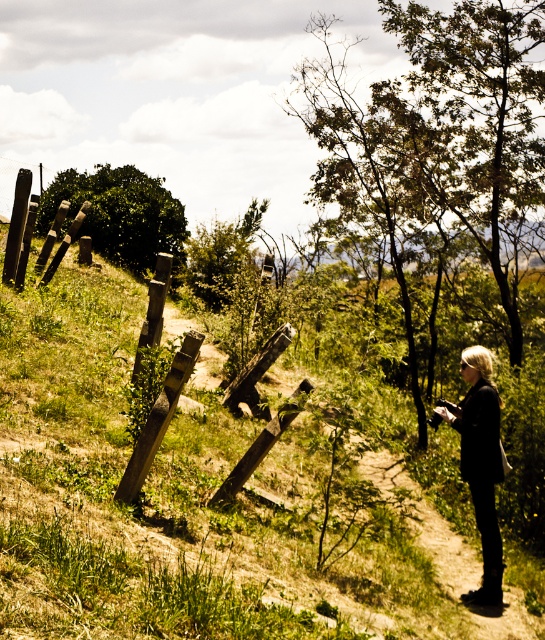
Question: Among these objects, which one is nearest to the camera?

Choices:
 (A) green leafy tree at upper left
 (B) black leather jacket at lower right
 (C) green leafy tree at right

Answer: (B)

Question: Which of the following is the closest to the observer?

Choices:
 (A) black leather jacket at lower right
 (B) green leafy tree at upper left

Answer: (A)

Question: Does green leafy tree at right appear on the right side of green leafy tree at upper left?

Choices:
 (A) no
 (B) yes

Answer: (B)

Question: Which object is farther from the camera taking this photo?

Choices:
 (A) black leather jacket at lower right
 (B) green leafy tree at upper left
 (C) green leafy tree at right

Answer: (B)

Question: Is green leafy tree at upper left above black leather jacket at lower right?

Choices:
 (A) no
 (B) yes

Answer: (B)

Question: Does green leafy tree at right lie in front of black leather jacket at lower right?

Choices:
 (A) no
 (B) yes

Answer: (A)